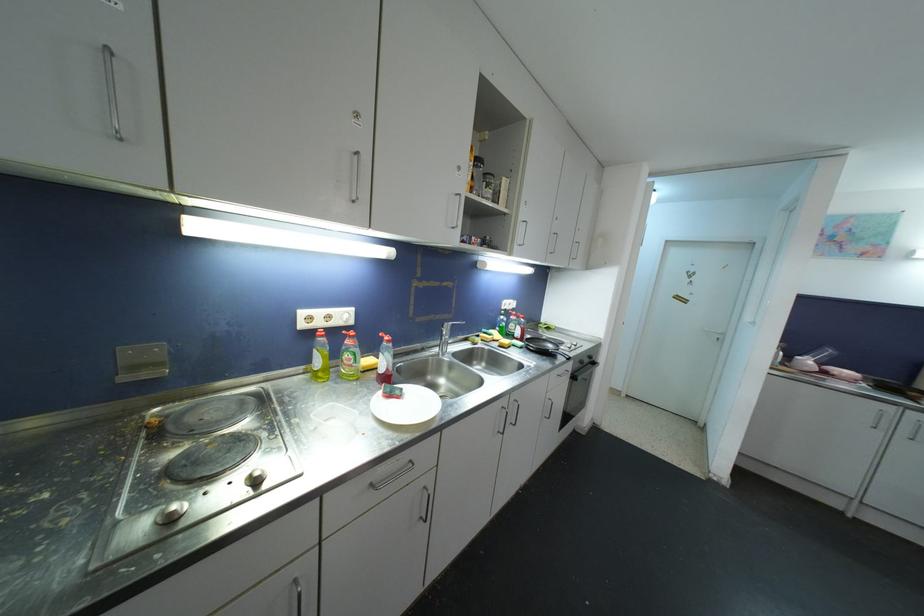
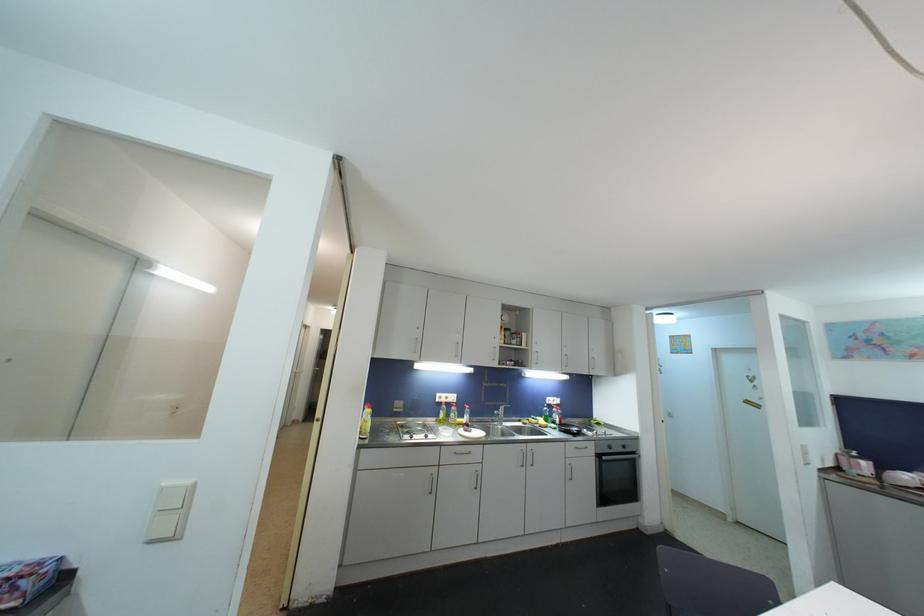
Where in the second image is the point corresponding to point 585,365 from the first image?

(613, 450)